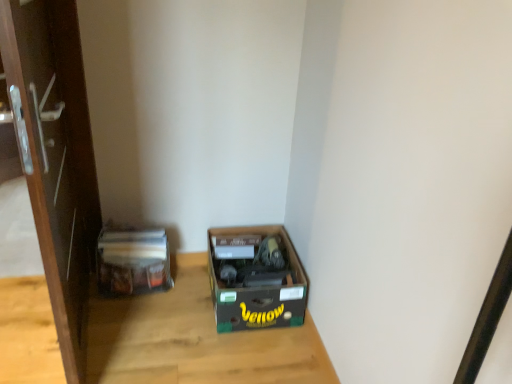
The height and width of the screenshot is (384, 512). In order to click on vacant space in between brown glossy door at left and matte plastic bag at left in this screenshot , I will do `click(131, 331)`.